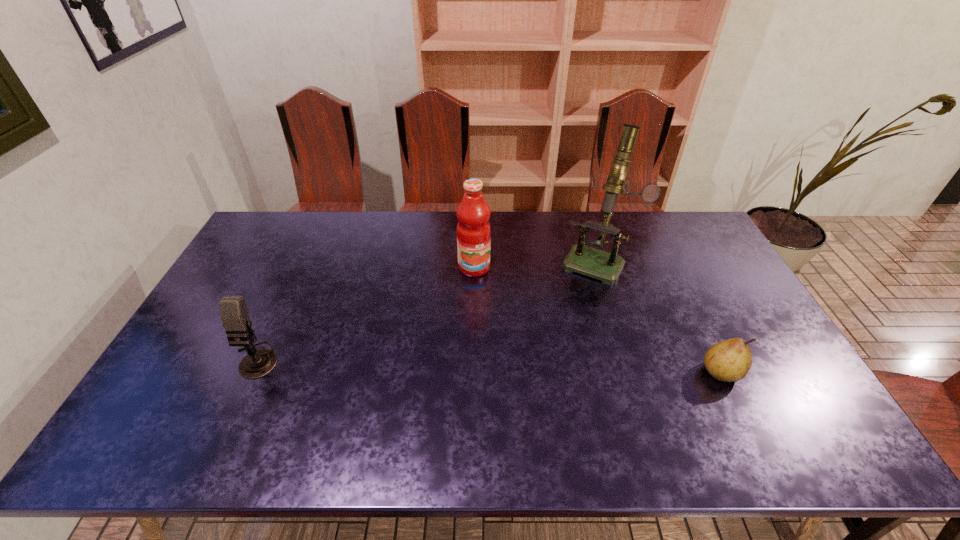
Where is `free space on the desktop that is between the second shortest object and the rightmost object and is positioned on the front label of the second tallest object`? This screenshot has height=540, width=960. free space on the desktop that is between the second shortest object and the rightmost object and is positioned on the front label of the second tallest object is located at coordinates (514, 366).

This screenshot has width=960, height=540. Find the location of `free space on the desktop that is between the leftmost object and the rightmost object and is positioned at the eyepiece of the second object from right to left`. free space on the desktop that is between the leftmost object and the rightmost object and is positioned at the eyepiece of the second object from right to left is located at coordinates (540, 367).